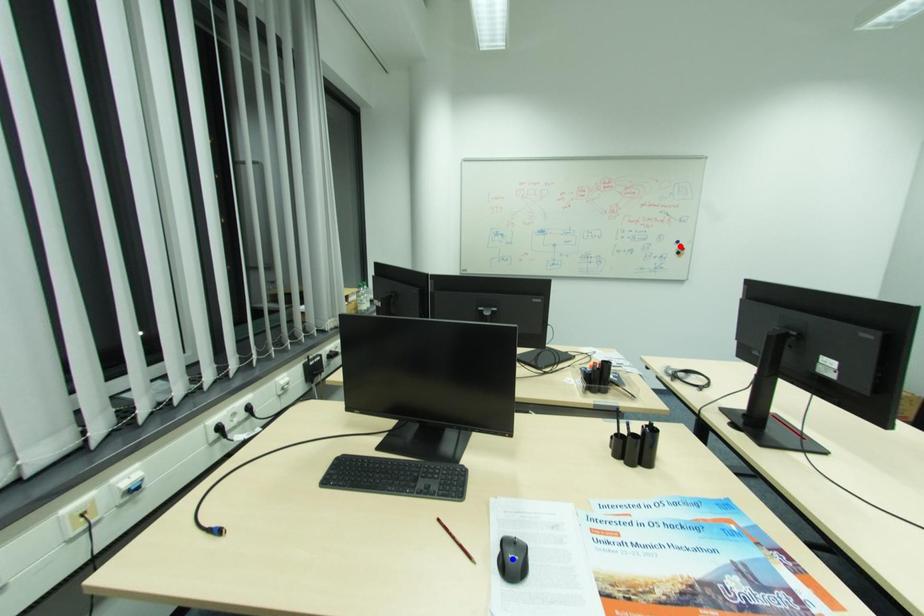
Question: In the image, two points are highlighted. Which point is nearer to the camera? Reply with the corresponding letter.

Choices:
 (A) blue point
 (B) red point

Answer: (A)